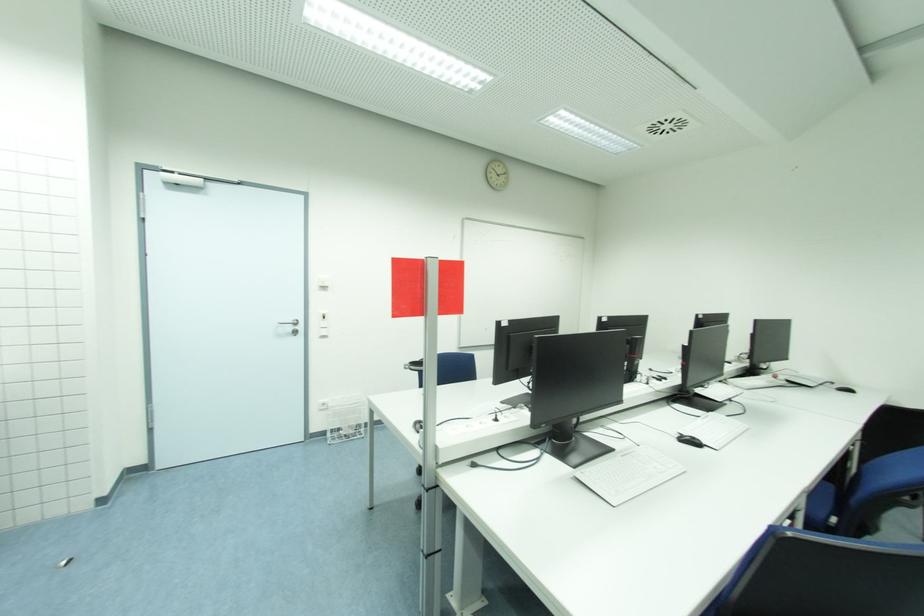
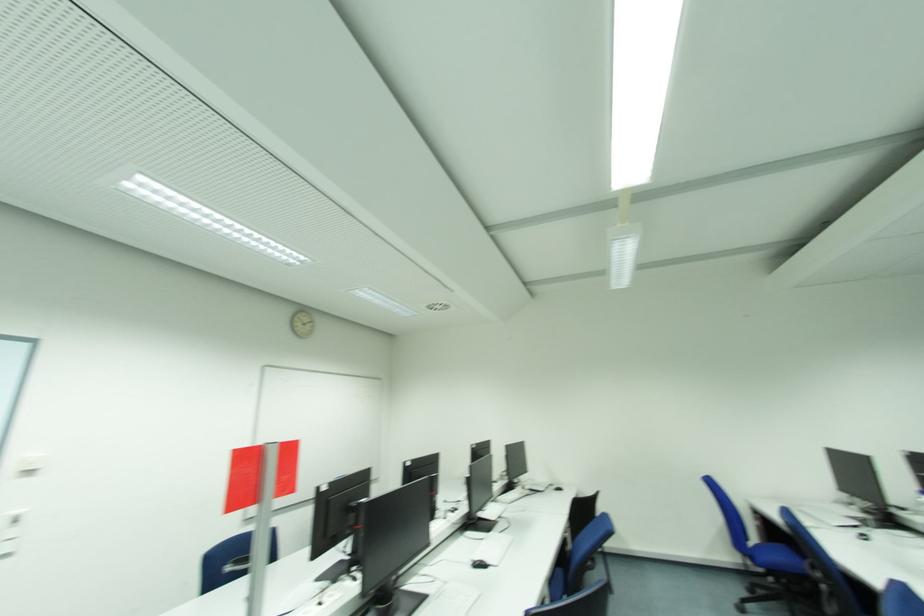
In the second image, find the point that corresponds to the point at 689,435 in the first image.

(480, 560)